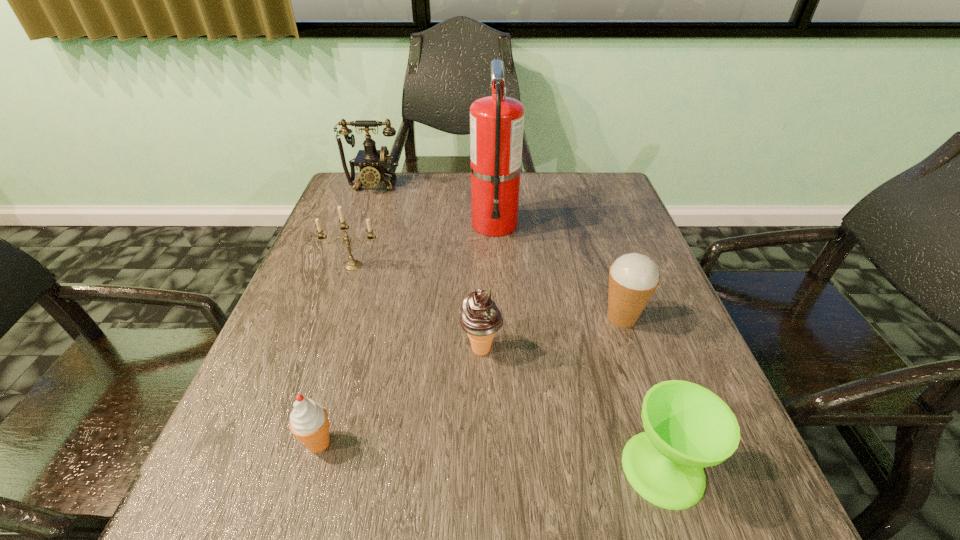
At what (x,y) coordinates should I click in order to perform the action: click on telephone positioned at the left edge. Please return your answer as a coordinate pair (x, y). The width and height of the screenshot is (960, 540). Looking at the image, I should click on (372, 163).

Locate an element on the screen. candle at the left edge is located at coordinates pyautogui.click(x=352, y=265).

Find the location of `icecream located at the left edge`. icecream located at the left edge is located at coordinates (309, 422).

This screenshot has width=960, height=540. I want to click on icecream at the right edge, so click(x=633, y=278).

Where is `wineglass located at the right edge`? This screenshot has height=540, width=960. wineglass located at the right edge is located at coordinates (687, 427).

Where is `object present at the far left corner`? The height and width of the screenshot is (540, 960). object present at the far left corner is located at coordinates (372, 163).

The image size is (960, 540). I want to click on object that is at the near right corner, so (x=687, y=427).

I want to click on free space at the far edge of the desktop, so click(x=404, y=202).

At what (x,y) coordinates should I click in order to perform the action: click on vacant space at the near edge. Please return your answer as a coordinate pair (x, y). Looking at the image, I should click on (404, 511).

The height and width of the screenshot is (540, 960). What are the coordinates of `vacant area at the left edge` in the screenshot? It's located at (300, 341).